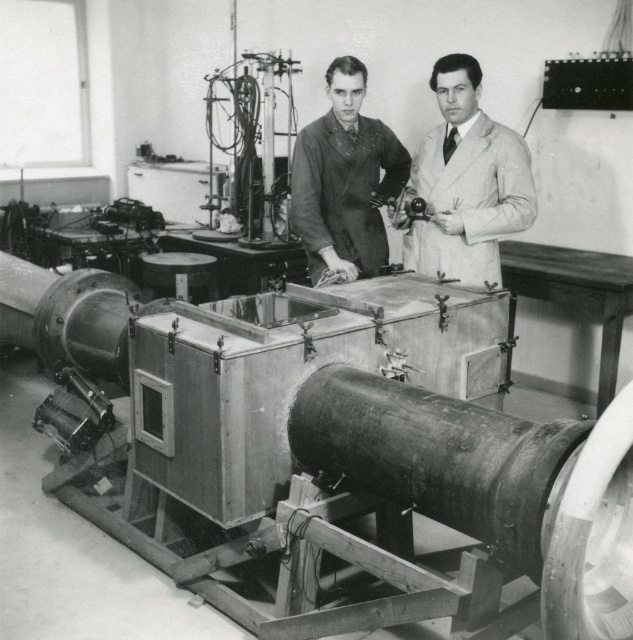
Does white wool coat at center have a larger size compared to smooth black suit at center?

No.

Is white wool coat at center thinner than smooth black suit at center?

In fact, white wool coat at center might be wider than smooth black suit at center.

Does point (499, 145) lie in front of point (337, 257)?

Yes, point (499, 145) is in front of point (337, 257).

Identify the location of white wool coat at center. The height and width of the screenshot is (640, 633). (465, 182).